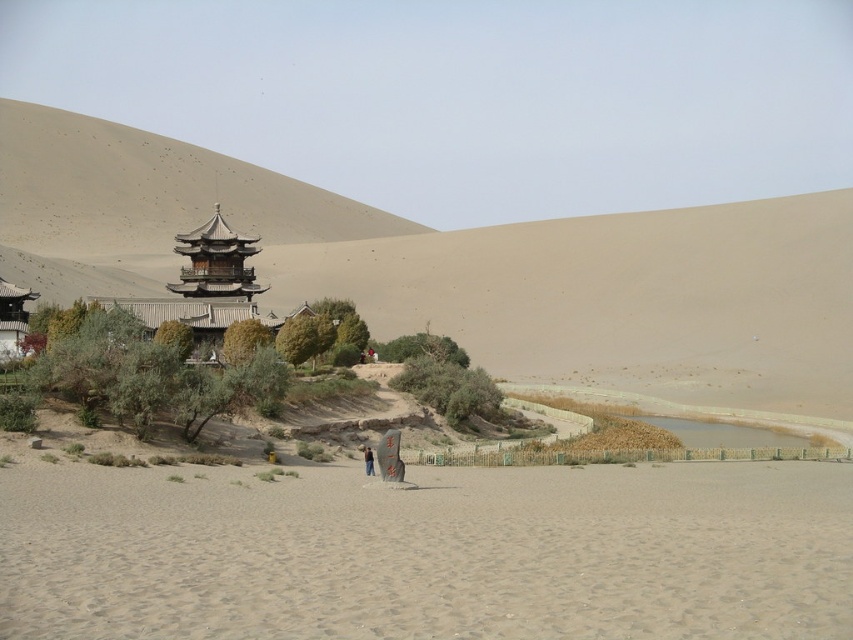
Question: In this image, where is smooth sand at lower center located relative to brown fabric person at center?

Choices:
 (A) below
 (B) above

Answer: (B)

Question: Among these points, which one is farthest from the camera?

Choices:
 (A) (836, 506)
 (B) (369, 452)

Answer: (B)

Question: Among these points, which one is nearest to the camera?

Choices:
 (A) (276, 545)
 (B) (372, 461)

Answer: (A)

Question: Does smooth sand at lower center appear on the right side of brown fabric person at center?

Choices:
 (A) yes
 (B) no

Answer: (A)

Question: Does smooth sand at lower center have a smaller size compared to brown fabric person at center?

Choices:
 (A) yes
 (B) no

Answer: (B)